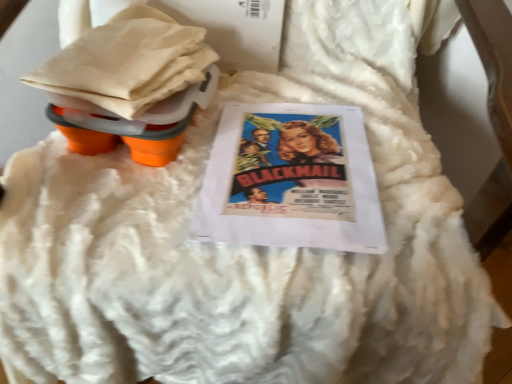
At what (x,y) coordinates should I click in order to perform the action: click on matte paper movie poster at center. Please return your answer as a coordinate pair (x, y). Image resolution: width=512 pixels, height=384 pixels. Looking at the image, I should click on (291, 180).

Describe the element at coordinates (291, 180) in the screenshot. I see `matte paper movie poster at center` at that location.

The width and height of the screenshot is (512, 384). Describe the element at coordinates (129, 84) in the screenshot. I see `orange rubberized cups at upper left` at that location.

Locate an element on the screen. orange rubberized cups at upper left is located at coordinates (129, 84).

This screenshot has height=384, width=512. Find the location of `matte paper movie poster at center`. matte paper movie poster at center is located at coordinates (291, 180).

Which object is positioned more to the right, orange rubberized cups at upper left or matte paper movie poster at center?

matte paper movie poster at center.

Between orange rubberized cups at upper left and matte paper movie poster at center, which one is positioned behind?

matte paper movie poster at center.

Between point (126, 22) and point (217, 213), which one is positioned in front?

The point (217, 213) is closer to the camera.

From the image's perspective, is orange rubberized cups at upper left above or below matte paper movie poster at center?

From the image's perspective, orange rubberized cups at upper left appears above matte paper movie poster at center.

From a real-world perspective, who is located higher, orange rubberized cups at upper left or matte paper movie poster at center?

orange rubberized cups at upper left.

Between orange rubberized cups at upper left and matte paper movie poster at center, which one has smaller width?

Thinner between the two is orange rubberized cups at upper left.

Does orange rubberized cups at upper left have a lesser height compared to matte paper movie poster at center?

No.

Does orange rubberized cups at upper left have a larger size compared to matte paper movie poster at center?

Correct, orange rubberized cups at upper left is larger in size than matte paper movie poster at center.

Choose the correct answer: Is orange rubberized cups at upper left inside matte paper movie poster at center or outside it?

orange rubberized cups at upper left is outside matte paper movie poster at center.

Are orange rubberized cups at upper left and matte paper movie poster at center beside each other?

orange rubberized cups at upper left and matte paper movie poster at center are not in contact.

Is orange rubberized cups at upper left oriented towards matte paper movie poster at center?

No, orange rubberized cups at upper left is not facing towards matte paper movie poster at center.

What's the angular difference between orange rubberized cups at upper left and matte paper movie poster at center's facing directions?

The facing directions of orange rubberized cups at upper left and matte paper movie poster at center are 2.73 degrees apart.

Find the location of a particular element. toy above the matte paper movie poster at center (from the image's perspective) is located at coordinates (129, 84).

Is matte paper movie poster at center to the right of orange rubberized cups at upper left from the viewer's perspective?

Yes, matte paper movie poster at center is to the right of orange rubberized cups at upper left.

Is matte paper movie poster at center further to the viewer compared to orange rubberized cups at upper left?

Yes, it is behind orange rubberized cups at upper left.

Does point (223, 184) come in front of point (82, 43)?

Yes, point (223, 184) is closer to viewer.

In the scene shown: From the image's perspective, is matte paper movie poster at center on top of orange rubberized cups at upper left?

Actually, matte paper movie poster at center appears below orange rubberized cups at upper left in the image.

From a real-world perspective, is matte paper movie poster at center physically below orange rubberized cups at upper left?

Indeed, from a real-world perspective, matte paper movie poster at center is positioned beneath orange rubberized cups at upper left.

Which of these two, matte paper movie poster at center or orange rubberized cups at upper left, is thinner?

orange rubberized cups at upper left.

Considering the sizes of objects matte paper movie poster at center and orange rubberized cups at upper left in the image provided, who is taller, matte paper movie poster at center or orange rubberized cups at upper left?

Answer: orange rubberized cups at upper left is taller.

Which of these two, matte paper movie poster at center or orange rubberized cups at upper left, is bigger?

orange rubberized cups at upper left.

Would you say orange rubberized cups at upper left is part of matte paper movie poster at center's contents?

No, orange rubberized cups at upper left is located outside of matte paper movie poster at center.

Is matte paper movie poster at center not near orange rubberized cups at upper left?

No, there isn't a large distance between matte paper movie poster at center and orange rubberized cups at upper left.

Could you tell me if matte paper movie poster at center is turned towards orange rubberized cups at upper left?

No, matte paper movie poster at center is not facing towards orange rubberized cups at upper left.

Can you tell me how much matte paper movie poster at center and orange rubberized cups at upper left differ in facing direction?

They differ by 2.73 degrees in their facing directions.

Measure the distance from matte paper movie poster at center to orange rubberized cups at upper left.

matte paper movie poster at center and orange rubberized cups at upper left are 6.02 inches apart.

Image resolution: width=512 pixels, height=384 pixels. What are the coordinates of `toy lying above the matte paper movie poster at center (from the image's perspective)` in the screenshot? It's located at (129, 84).

This screenshot has height=384, width=512. I want to click on comic book below the orange rubberized cups at upper left (from the image's perspective), so click(x=291, y=180).

Where is `comic book that appears behind the orange rubberized cups at upper left`? The width and height of the screenshot is (512, 384). comic book that appears behind the orange rubberized cups at upper left is located at coordinates (291, 180).